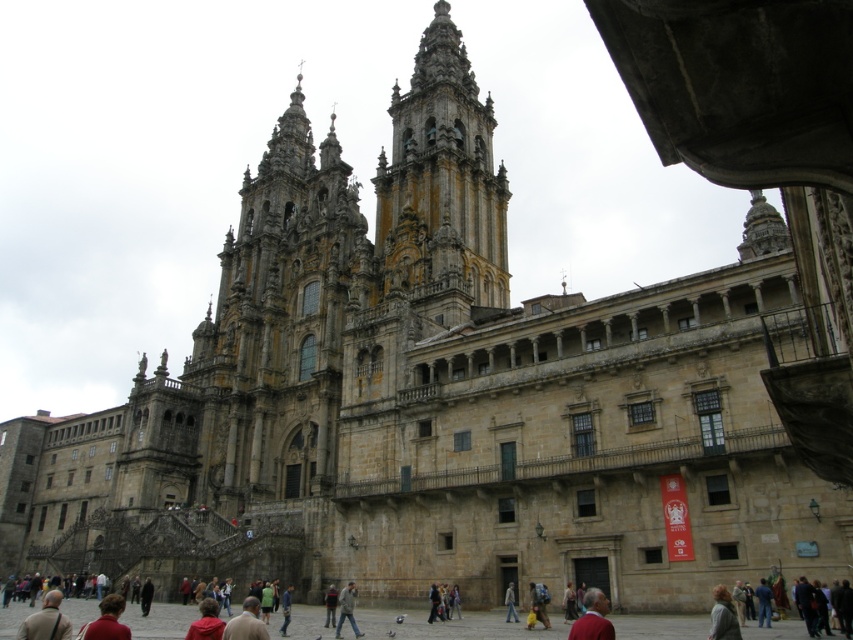
Question: Can you confirm if brown leather jacket at lower center is positioned to the left of red fabric jacket at lower left?

Choices:
 (A) yes
 (B) no

Answer: (B)

Question: Does light brown leather jacket at lower left appear on the right side of gray fabric jacket at center?

Choices:
 (A) no
 (B) yes

Answer: (A)

Question: Which point appears closest to the camera in this image?

Choices:
 (A) (102, 636)
 (B) (45, 621)
 (C) (459, 138)
 (D) (509, 602)

Answer: (A)

Question: Which point appears farthest from the camera in this image?

Choices:
 (A) (740, 637)
 (B) (337, 625)
 (C) (508, 595)
 (D) (123, 630)

Answer: (C)

Question: Which of the following is the farthest from the observer?

Choices:
 (A) (720, 620)
 (B) (355, 634)
 (C) (91, 628)

Answer: (B)

Question: Is light brown hair at lower right bigger than light brown leather jacket at center?

Choices:
 (A) yes
 (B) no

Answer: (A)